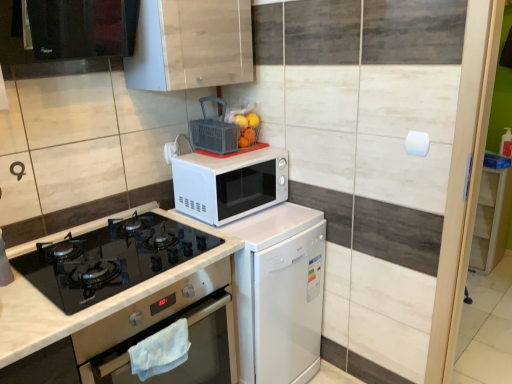
Question: Is white glossy dishwasher at center located outside matte plastic basket at upper center, the first appliance in the right-to-left sequence?

Choices:
 (A) yes
 (B) no

Answer: (A)

Question: Considering the relative positions of white glossy dishwasher at center and matte plastic basket at upper center, which ranks as the second appliance in left-to-right order, in the image provided, is white glossy dishwasher at center to the left of matte plastic basket at upper center, which ranks as the second appliance in left-to-right order, from the viewer's perspective?

Choices:
 (A) no
 (B) yes

Answer: (A)

Question: Would you say white glossy dishwasher at center contains matte plastic basket at upper center, which ranks as the second appliance in left-to-right order?

Choices:
 (A) no
 (B) yes

Answer: (A)

Question: Is white glossy dishwasher at center positioned with its back to matte plastic basket at upper center, which ranks as the second appliance in left-to-right order?

Choices:
 (A) yes
 (B) no

Answer: (B)

Question: Can you confirm if white glossy dishwasher at center is wider than matte plastic basket at upper center, which ranks as the second appliance in left-to-right order?

Choices:
 (A) yes
 (B) no

Answer: (A)

Question: Is white matte microwave at center, which appears as the second appliance when viewed from the right, taller or shorter than black glass exhaust hood at upper left?

Choices:
 (A) short
 (B) tall

Answer: (A)

Question: Considering the positions of point (172, 147) and point (53, 51), is point (172, 147) closer or farther from the camera than point (53, 51)?

Choices:
 (A) farther
 (B) closer

Answer: (A)

Question: Would you say white matte microwave at center, which appears as the second appliance when viewed from the right, is to the left or to the right of black glass exhaust hood at upper left in the picture?

Choices:
 (A) left
 (B) right

Answer: (B)

Question: From a real-world perspective, is white matte microwave at center, which ranks as the 1th appliance in left-to-right order, positioned above or below black glass exhaust hood at upper left?

Choices:
 (A) above
 (B) below

Answer: (B)

Question: Is wooden cabinet at upper center, which is the second cabinetry from right to left, to the left or to the right of matte plastic basket at upper center, which ranks as the second appliance in left-to-right order, in the image?

Choices:
 (A) left
 (B) right

Answer: (A)

Question: Does point (163, 72) appear closer or farther from the camera than point (196, 140)?

Choices:
 (A) closer
 (B) farther

Answer: (A)

Question: Is wooden cabinet at upper center, which is the second cabinetry from right to left, bigger or smaller than matte plastic basket at upper center, the first appliance in the right-to-left sequence?

Choices:
 (A) big
 (B) small

Answer: (A)

Question: Is wooden cabinet at upper center, acting as the first cabinetry starting from the top, in front of or behind matte plastic basket at upper center, the first appliance in the right-to-left sequence, in the image?

Choices:
 (A) front
 (B) behind

Answer: (A)

Question: Is matte plastic basket at upper center, the first appliance in the right-to-left sequence, situated inside wooden cabinet at upper center, which is the second cabinetry from right to left, or outside?

Choices:
 (A) outside
 (B) inside

Answer: (A)

Question: Is matte plastic basket at upper center, the first appliance in the right-to-left sequence, to the left or to the right of wooden cabinet at upper center, marked as the second cabinetry in a bottom-to-top arrangement, in the image?

Choices:
 (A) left
 (B) right

Answer: (B)